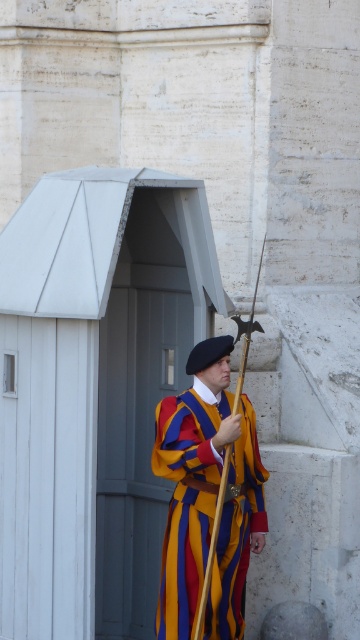
Is point (30, 449) behind point (186, 568)?

Yes, point (30, 449) is farther from viewer.

Where is `white painted wood hut at center`? The image size is (360, 640). white painted wood hut at center is located at coordinates (93, 390).

I want to click on white painted wood hut at center, so click(93, 390).